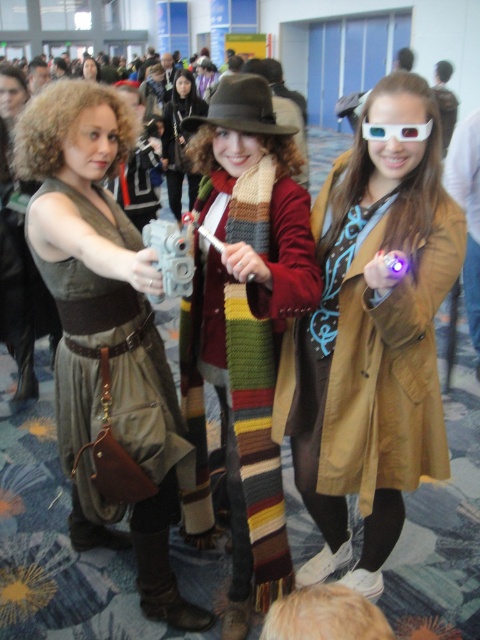
Question: Which point is farther from the camera taking this photo?

Choices:
 (A) (384, 129)
 (B) (392, 339)

Answer: (A)

Question: Which of the following is the closest to the observer?

Choices:
 (A) matte brown dress at center
 (B) shiny black hair at center

Answer: (A)

Question: Can you confirm if brown leather coat at center is positioned to the left of transparent plastic goggles at center?

Choices:
 (A) yes
 (B) no

Answer: (B)

Question: Which point appears farthest from the camera in this image?

Choices:
 (A) (315, 390)
 (B) (178, 129)

Answer: (B)

Question: Can you confirm if brown leather coat at center is smaller than transparent plastic goggles at center?

Choices:
 (A) no
 (B) yes

Answer: (A)

Question: Can you confirm if matte brown dress at center is smaller than shiny black hair at center?

Choices:
 (A) yes
 (B) no

Answer: (B)